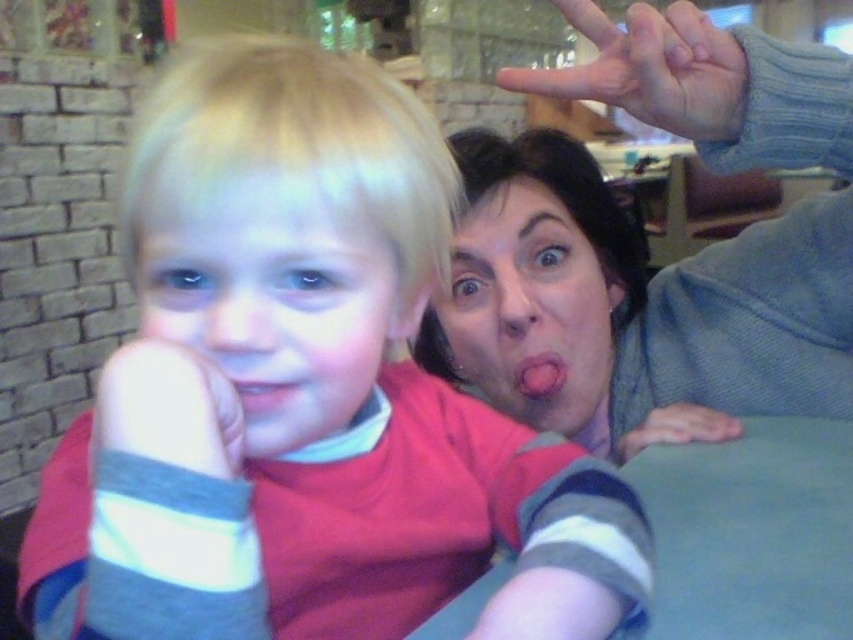
Looking at this image, you are a photographer trying to capture the perfect shot of the pink glossy lips at center and the pink matte tongue at center. Which object should you focus on first if you want to ensure both are in sharp focus?

The pink glossy lips at center is positioned over the pink matte tongue at center, so focusing on the pink glossy lips at center first would ensure both are in sharp focus since it is closer to the camera.

In the scene shown: You are a photographer trying to capture a closeup of both the pink glossy lips at center and the pink matte tongue at center in the image. Given that your camera can only focus on objects within a 15 inch range, will you be able to capture both in focus?

The pink glossy lips at center is 17.20 inches away from the pink matte tongue at center. Since the distance between them exceeds the camera focus range of 15 inches, you won generated by the system. 17.20 is greater than 15 so the answer is no. The answer should be concise and factual. Let me rephrase. The distance between the pink glossy lips at center and the pink matte tongue at center is 17.20 inches, which is beyond the camera focus range of 15 inches. Therefore, you cannot capture both in focus.